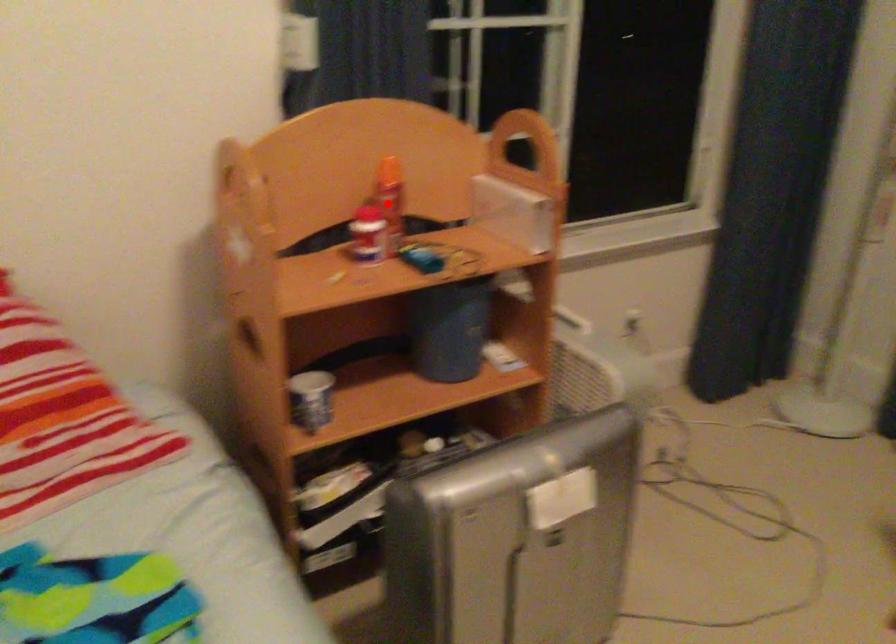
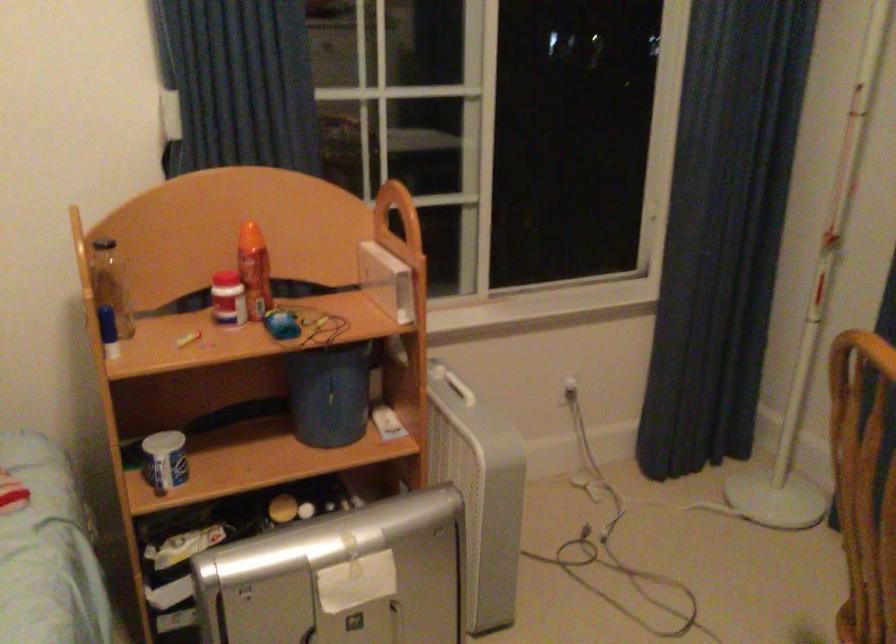
Find the pixel in the second image that matches the highlighted location in the first image.

(254, 270)